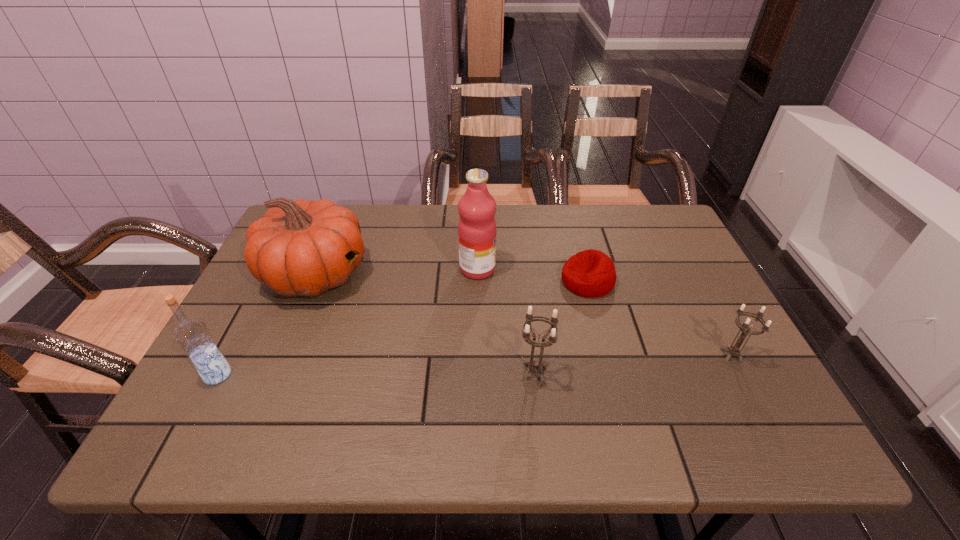
This screenshot has width=960, height=540. I want to click on free area in between the vodka and the pumpkin, so click(x=267, y=324).

I want to click on the second closest object relative to the right candle holder, so click(x=534, y=366).

Select which object appears as the closest to the rightmost object. Please provide its 2D coordinates. Your answer should be formatted as a tuple, i.e. [(x, y)], where the tuple contains the x and y coordinates of a point satisfying the conditions above.

[(591, 273)]

Locate an element on the screen. vacant space that satisfies the following two spatial constraints: 1. on the seat area of the shortest object; 2. on the back side of the rightmost object is located at coordinates (608, 356).

Find the location of a particular element. This screenshot has width=960, height=540. vacant space that satisfies the following two spatial constraints: 1. on the seat area of the shortest object; 2. on the front side of the taller candle holder is located at coordinates (612, 374).

Where is `free location that satisfies the following two spatial constraints: 1. on the seat area of the second object from right to left; 2. on the back side of the rightmost object`? The image size is (960, 540). free location that satisfies the following two spatial constraints: 1. on the seat area of the second object from right to left; 2. on the back side of the rightmost object is located at coordinates (608, 356).

At what (x,y) coordinates should I click in order to perform the action: click on vacant point that satisfies the following two spatial constraints: 1. on the face of the left candle holder; 2. on the left side of the pumpkin. Please return your answer as a coordinate pair (x, y). Looking at the image, I should click on (275, 374).